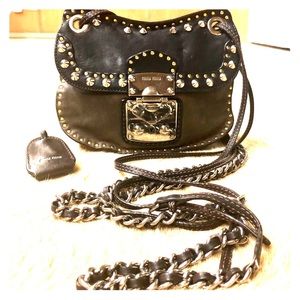
Locate an element on the screen. Image resolution: width=300 pixels, height=300 pixels. molding is located at coordinates (40, 35).